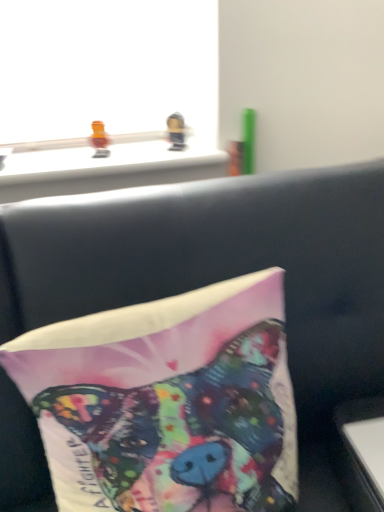
Question: Relative to white glossy table at lower right, is metallic gold toy at upper center, the 2th toy positioned from the left, in front or behind?

Choices:
 (A) behind
 (B) front

Answer: (A)

Question: Is point (183, 145) closer or farther from the camera than point (354, 406)?

Choices:
 (A) closer
 (B) farther

Answer: (B)

Question: Estimate the real-world distances between objects in this image. Which object is closer to the silky fabric pillow at center?

Choices:
 (A) metallic gold toy at upper center, the 2th toy positioned from the left
 (B) translucent orange toy at upper left, the 1th toy viewed from the left
 (C) white glossy table at lower right

Answer: (C)

Question: Based on their relative distances, which object is farther from the metallic gold toy at upper center, marked as the 1th toy in a right-to-left arrangement?

Choices:
 (A) white glossy table at lower right
 (B) silky fabric pillow at center
 (C) translucent orange toy at upper left, arranged as the 2th toy when viewed from the right

Answer: (A)